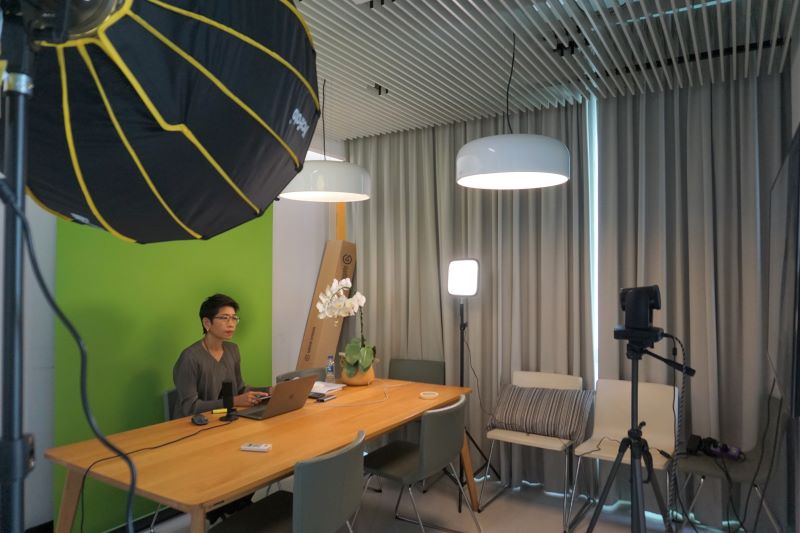
Where is `curtains`? curtains is located at coordinates (410, 273), (556, 276).